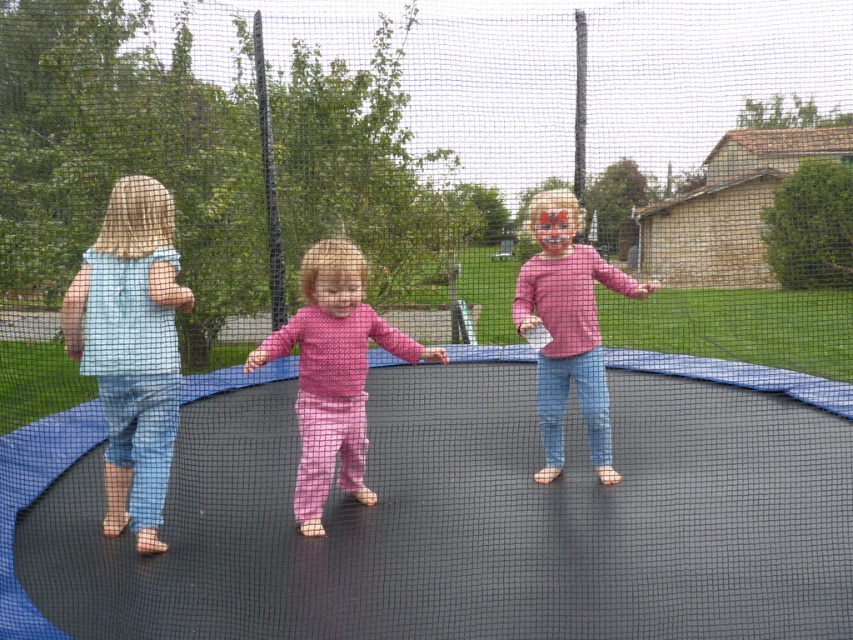
You are a photographer trying to capture a closeup shot of the pink fabric pants at center and the pink matte shirt at center. Which one should you focus on to ensure it appears sharper in the photo?

The pink fabric pants at center should be focused on because it is closer to the viewer than the pink matte shirt at center, so focusing on it will make it sharper.

You are a photographer trying to capture a photo of the light blue denim jumpsuit at left and the pink fabric pants at center. Based on their heights, which child should you focus on first if you want to ensure both are in frame?

Result: The light blue denim jumpsuit at left is much taller than the pink fabric pants at center, so you should focus on the light blue denim jumpsuit at left first to ensure both are in frame.